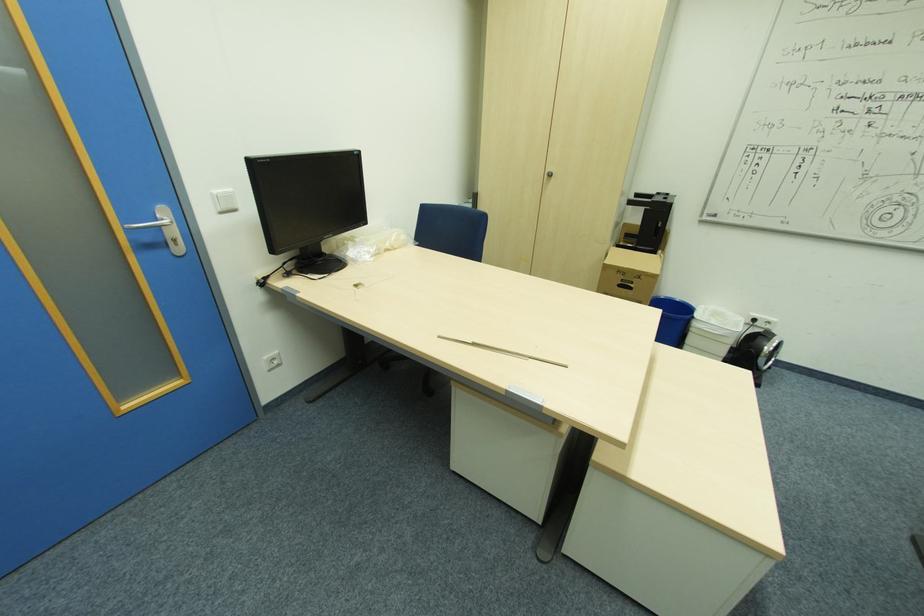
Where is `silver door handle`? This screenshot has height=616, width=924. silver door handle is located at coordinates (154, 220).